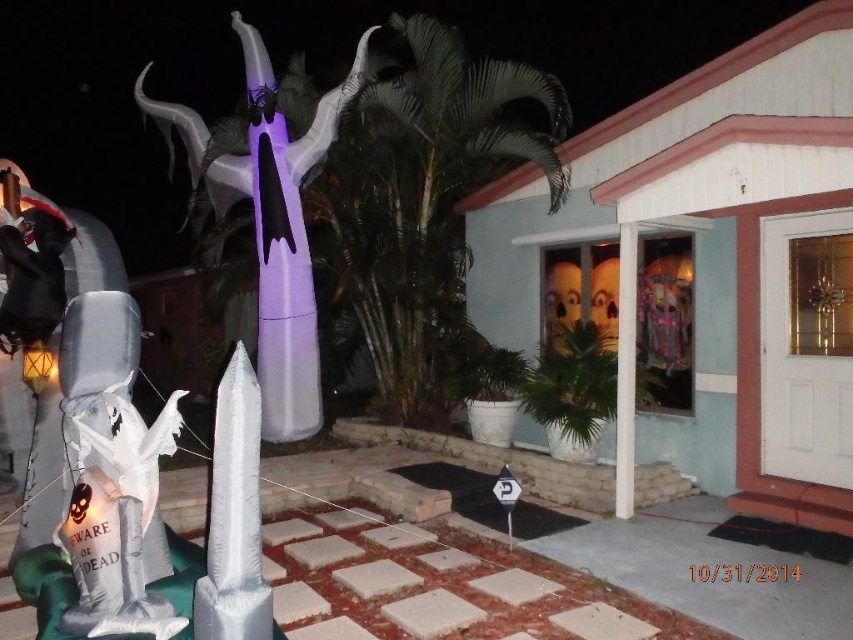
You are a delivery person trying to navigate through the Halloween decorations in front of the house. The white glossy ghost at lower left and the purple inflatable ghost at center are blocking your path. Which ghost should you move to create more space for your delivery cart?

The purple inflatable ghost at center is larger than the white glossy ghost at lower left, so moving the purple inflatable ghost at center would create more space for the delivery cart.

You are a delivery person trying to navigate through the Halloween decorations to reach the front door. The white glossy ghost at lower left and the purple inflatable ghost at center are in your path. Can you pass between them without touching either? Explain your reasoning.

The white glossy ghost at lower left and the purple inflatable ghost at center are 2.90 meters apart. Since the distance between them is 2.90 meters, which is more than enough space for a person to pass through without touching either decoration, you can safely navigate between them to reach the front door.